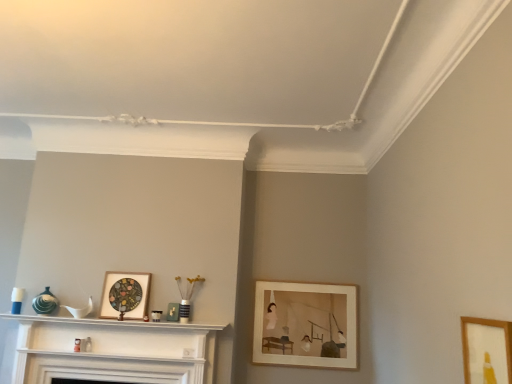
Locate an element on the screen. Image resolution: width=512 pixels, height=384 pixels. free point above wooden stained picture frame at center, the 2th picture frame in the front-to-back sequence (from a real-world perspective) is located at coordinates (129, 275).